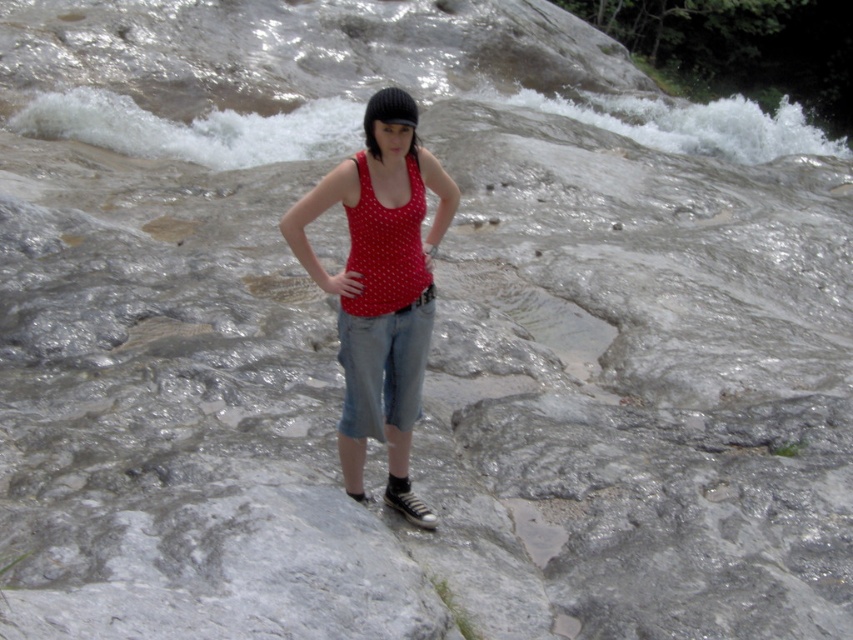
Question: Estimate the real-world distances between objects in this image. Which object is farther from the denim at center?

Choices:
 (A) red polka dot tank top at center
 (B) polka dot fabric tank top at center

Answer: (A)

Question: From the image, what is the correct spatial relationship of polka dot fabric tank top at center in relation to denim at center?

Choices:
 (A) right
 (B) left

Answer: (B)

Question: Which point is closer to the camera taking this photo?

Choices:
 (A) (370, 435)
 (B) (409, 246)
 (C) (425, 317)

Answer: (B)

Question: Considering the relative positions of denim at center and red polka dot tank top at center in the image provided, where is denim at center located with respect to red polka dot tank top at center?

Choices:
 (A) right
 (B) left

Answer: (B)

Question: Which object is positioned closest to the red polka dot tank top at center?

Choices:
 (A) denim at center
 (B) polka dot fabric tank top at center

Answer: (B)

Question: Does denim at center have a larger size compared to red polka dot tank top at center?

Choices:
 (A) yes
 (B) no

Answer: (A)